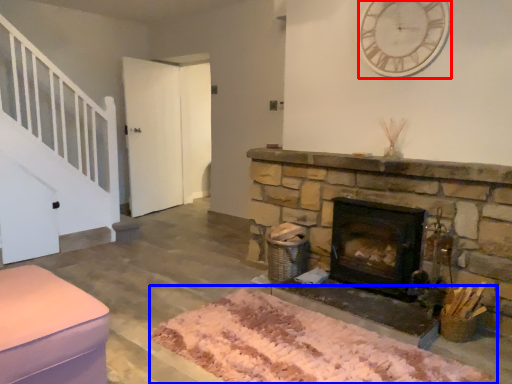
Question: Which of the following is the farthest to the observer, clock (highlighted by a red box) or mat (highlighted by a blue box)?

Choices:
 (A) clock
 (B) mat

Answer: (A)